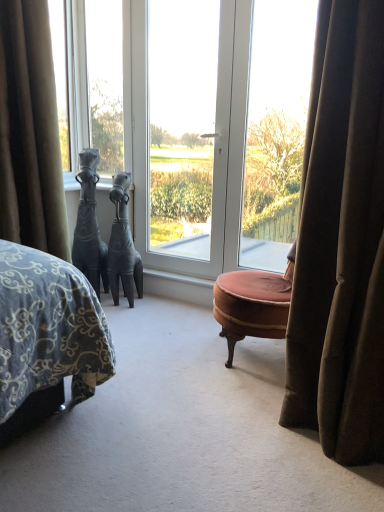
At what (x,y) coordinates should I click in order to perform the action: click on free point to the left of velvet brown ottoman at center. Please return your answer as a coordinate pair (x, y). The width and height of the screenshot is (384, 512). Looking at the image, I should click on (168, 356).